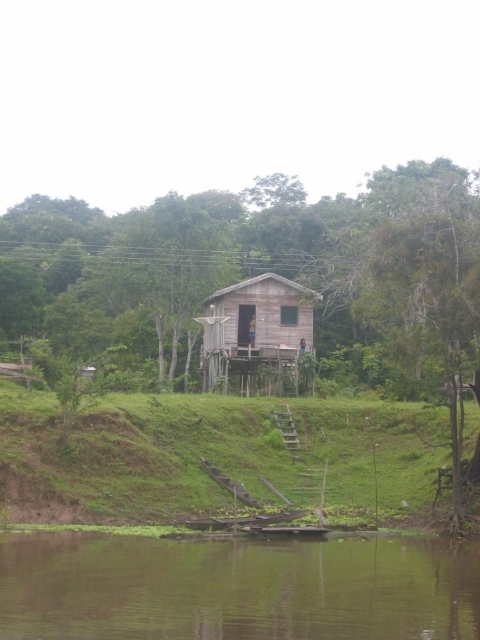
Question: Which object is the farthest from the brown wooden hut at center?

Choices:
 (A) green smooth water at lower center
 (B) green leafy tree at center
 (C) green grassy hillside at lower center

Answer: (A)

Question: Can you confirm if green smooth water at lower center is wider than green grassy hillside at lower center?

Choices:
 (A) no
 (B) yes

Answer: (A)

Question: Which object appears farthest from the camera in this image?

Choices:
 (A) green smooth water at lower center
 (B) brown wooden hut at center
 (C) green grassy hillside at lower center
 (D) green leafy tree at center

Answer: (B)

Question: Does green leafy tree at center have a larger size compared to brown wooden hut at center?

Choices:
 (A) no
 (B) yes

Answer: (B)

Question: Which of the following is the closest to the observer?

Choices:
 (A) (142, 573)
 (B) (16, 488)

Answer: (A)

Question: Is green grassy hillside at lower center positioned in front of brown wooden hut at center?

Choices:
 (A) yes
 (B) no

Answer: (A)